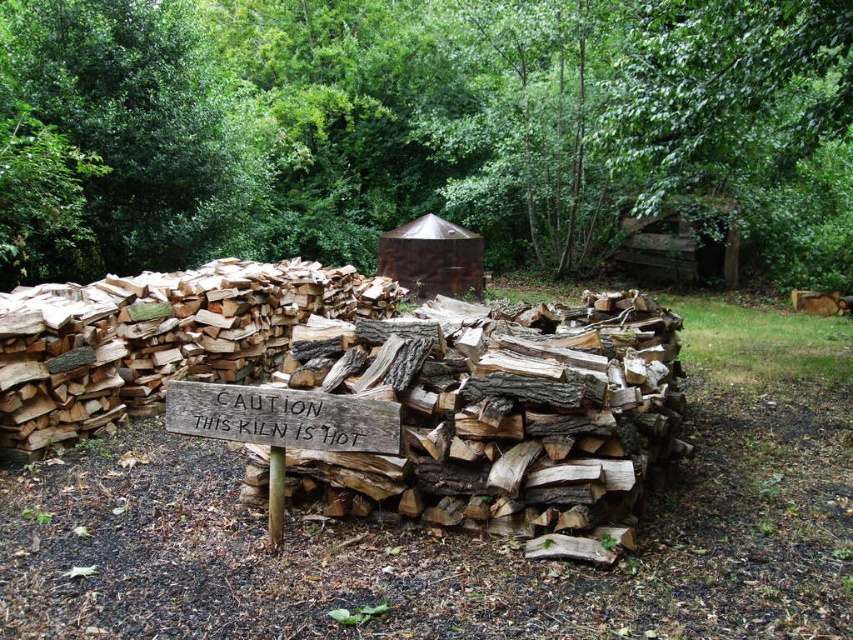
Question: Which point appears farthest from the camera in this image?

Choices:
 (A) (293, 440)
 (B) (827, 182)

Answer: (B)

Question: In this image, where is green leafy tree at upper center located relative to weathered wood sign at center?

Choices:
 (A) left
 (B) right

Answer: (A)

Question: Is green leafy tree at upper center to the right of weathered wood sign at center from the viewer's perspective?

Choices:
 (A) yes
 (B) no

Answer: (B)

Question: Which point is closer to the camera?

Choices:
 (A) (154, 129)
 (B) (190, 403)

Answer: (B)

Question: Can you confirm if green leafy tree at upper center is smaller than weathered wood sign at center?

Choices:
 (A) no
 (B) yes

Answer: (A)

Question: Which point appears closest to the camera in this image?

Choices:
 (A) (326, 401)
 (B) (755, 104)

Answer: (A)